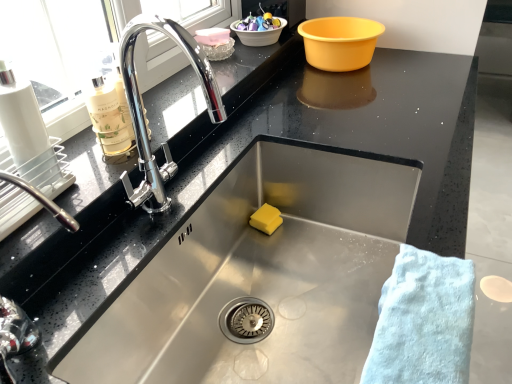
Image resolution: width=512 pixels, height=384 pixels. What do you see at coordinates (42, 201) in the screenshot?
I see `polished chrome tap at left` at bounding box center [42, 201].

Identify the location of yellow plastic basin at upper right, positioned as the 1th basin in right-to-left order. click(339, 42).

Where is `glossy ceramic bowl at upper center, which appears as the 1th food when viewed from the back`? This screenshot has height=384, width=512. glossy ceramic bowl at upper center, which appears as the 1th food when viewed from the back is located at coordinates (259, 23).

Can you confirm if white plastic basin at upper center, which is the 2th basin from left to right, is taller than translucent plastic bowl at upper center, acting as the first basin starting from the left?

Yes.

Is point (253, 44) positioned after point (209, 45)?

Yes, point (253, 44) is farther from viewer.

Is white plastic basin at upper center, positioned as the second basin in right-to-left order, outside of translucent plastic bowl at upper center, which ranks as the 3th basin in right-to-left order?

Absolutely, white plastic basin at upper center, positioned as the second basin in right-to-left order, is external to translucent plastic bowl at upper center, which ranks as the 3th basin in right-to-left order.

Considering the relative positions of white plastic basin at upper center, positioned as the second basin in right-to-left order, and translucent plastic bowl at upper center, which ranks as the 3th basin in right-to-left order, in the image provided, is white plastic basin at upper center, positioned as the second basin in right-to-left order, to the left of translucent plastic bowl at upper center, which ranks as the 3th basin in right-to-left order, from the viewer's perspective?

No, white plastic basin at upper center, positioned as the second basin in right-to-left order, is not to the left of translucent plastic bowl at upper center, which ranks as the 3th basin in right-to-left order.

Is yellow plastic basin at upper right, positioned as the third basin in left-to-right order, bigger than pink plastic container at upper center, placed as the second food when sorted from back to front?

Indeed, yellow plastic basin at upper right, positioned as the third basin in left-to-right order, has a larger size compared to pink plastic container at upper center, placed as the second food when sorted from back to front.

Is yellow plastic basin at upper right, positioned as the 1th basin in right-to-left order, at the left side of pink plastic container at upper center, marked as the second food in a top-to-bottom arrangement?

No, yellow plastic basin at upper right, positioned as the 1th basin in right-to-left order, is not to the left of pink plastic container at upper center, marked as the second food in a top-to-bottom arrangement.

Does point (339, 52) come farther from viewer compared to point (221, 44)?

Yes, point (339, 52) is behind point (221, 44).

Is yellow plastic basin at upper right, positioned as the third basin in left-to-right order, not close to pink plastic container at upper center, placed as the second food when sorted from back to front?

yellow plastic basin at upper right, positioned as the third basin in left-to-right order, is actually quite close to pink plastic container at upper center, placed as the second food when sorted from back to front.

Which of these two, white plastic basin at upper center, positioned as the second basin in right-to-left order, or light blue cotton towel at lower right, stands taller?

Standing taller between the two is white plastic basin at upper center, positioned as the second basin in right-to-left order.

From the image's perspective, relative to light blue cotton towel at lower right, is white plastic basin at upper center, which is the 2th basin from left to right, above or below?

white plastic basin at upper center, which is the 2th basin from left to right, is above light blue cotton towel at lower right.

Does white plastic basin at upper center, which is the 2th basin from left to right, have a smaller size compared to light blue cotton towel at lower right?

Yes.

Find the location of a particular element. Image resolution: width=512 pixels, height=384 pixels. bath towel below the white plastic basin at upper center, positioned as the second basin in right-to-left order (from a real-world perspective) is located at coordinates (423, 321).

From the picture: Which object is further away from the camera taking this photo, pink plastic container at upper center, the second food in the front-to-back sequence, or translucent plastic bowl at upper center, acting as the first basin starting from the left?

translucent plastic bowl at upper center, acting as the first basin starting from the left, is behind.

Who is taller, pink plastic container at upper center, the second food in the front-to-back sequence, or translucent plastic bowl at upper center, acting as the first basin starting from the left?

With more height is translucent plastic bowl at upper center, acting as the first basin starting from the left.

Measure the distance from pink plastic container at upper center, placed as the second food when sorted from back to front, to translucent plastic bowl at upper center, acting as the first basin starting from the left.

A distance of 1.23 inches exists between pink plastic container at upper center, placed as the second food when sorted from back to front, and translucent plastic bowl at upper center, acting as the first basin starting from the left.

Would you consider pink plastic container at upper center, placed as the second food when sorted from back to front, to be distant from translucent plastic bowl at upper center, which ranks as the 3th basin in right-to-left order?

No.

Is point (211, 38) farther from camera compared to point (272, 25)?

No.

Is pink plastic container at upper center, marked as the second food in a top-to-bottom arrangement, to the left of glossy ceramic bowl at upper center, which appears as the 1th food when viewed from the back, from the viewer's perspective?

Indeed, pink plastic container at upper center, marked as the second food in a top-to-bottom arrangement, is positioned on the left side of glossy ceramic bowl at upper center, which appears as the 1th food when viewed from the back.

Can you tell me how much pink plastic container at upper center, placed as the second food when sorted from back to front, and glossy ceramic bowl at upper center, the first food when ordered from top to bottom, differ in facing direction?

The facing directions of pink plastic container at upper center, placed as the second food when sorted from back to front, and glossy ceramic bowl at upper center, the first food when ordered from top to bottom, are 0.0013 degrees apart.

From the picture: Is there a large distance between pink plastic container at upper center, placed as the second food when sorted from back to front, and glossy ceramic bowl at upper center, which appears as the 1th food when viewed from the back?

pink plastic container at upper center, placed as the second food when sorted from back to front, is near glossy ceramic bowl at upper center, which appears as the 1th food when viewed from the back, not far away.

Is there a large distance between yellow sponge at sink bottom, positioned as the first food in front-to-back order, and translucent glass bottle at left?

They are positioned close to each other.

From a real-world perspective, between yellow sponge at sink bottom, positioned as the first food in front-to-back order, and translucent glass bottle at left, who is vertically higher?

In real-world perspective, translucent glass bottle at left is above.

From the image's perspective, is yellow sponge at sink bottom, positioned as the first food in front-to-back order, on translucent glass bottle at left?

Incorrect, from the image's perspective, yellow sponge at sink bottom, positioned as the first food in front-to-back order, is lower than translucent glass bottle at left.

Do you think yellow sponge at sink bottom, positioned as the first food in front-to-back order, is within translucent glass bottle at left, or outside of it?

yellow sponge at sink bottom, positioned as the first food in front-to-back order, is located beyond the bounds of translucent glass bottle at left.

Who is bigger, pink plastic container at upper center, the second food positioned from the bottom, or translucent glass bottle at left?

translucent glass bottle at left is bigger.

From a real-world perspective, is pink plastic container at upper center, the second food positioned from the bottom, above or below translucent glass bottle at left?

pink plastic container at upper center, the second food positioned from the bottom, is below translucent glass bottle at left.

Consider the image. Is pink plastic container at upper center, the second food in the front-to-back sequence, far from translucent glass bottle at left?

No.

Image resolution: width=512 pixels, height=384 pixels. Find the location of `cleaning product above the pink plastic container at upper center, the second food positioned from the bottom (from a real-world perspective)`. cleaning product above the pink plastic container at upper center, the second food positioned from the bottom (from a real-world perspective) is located at coordinates (110, 118).

At what (x,y) coordinates should I click in order to perform the action: click on the 1st basin in front when counting from the white plastic basin at upper center, which is the 2th basin from left to right. Please return your answer as a coordinate pair (x, y). Looking at the image, I should click on (219, 51).

This screenshot has width=512, height=384. There is a yellow plastic basin at upper right, positioned as the 1th basin in right-to-left order. What are the coordinates of `the 1st food above it (from a real-world perspective)` in the screenshot? It's located at (212, 36).

Based on their spatial positions, is light blue cotton towel at lower right or glossy ceramic bowl at upper center, marked as the 3th food in a front-to-back arrangement, closer to white plastic basin at upper center, which is the 2th basin from left to right?

The object closer to white plastic basin at upper center, which is the 2th basin from left to right, is glossy ceramic bowl at upper center, marked as the 3th food in a front-to-back arrangement.

Based on their spatial positions, is light blue cotton towel at lower right or pink plastic container at upper center, placed as the second food when sorted from back to front, closer to translucent plastic bowl at upper center, acting as the first basin starting from the left?

pink plastic container at upper center, placed as the second food when sorted from back to front, lies closer to translucent plastic bowl at upper center, acting as the first basin starting from the left, than the other object.

Based on the photo, which object lies nearer to the anchor point glossy ceramic bowl at upper center, which appears as the 1th food when viewed from the back, translucent plastic bowl at upper center, which ranks as the 3th basin in right-to-left order, or yellow plastic basin at upper right, positioned as the third basin in left-to-right order?

Among the two, translucent plastic bowl at upper center, which ranks as the 3th basin in right-to-left order, is located nearer to glossy ceramic bowl at upper center, which appears as the 1th food when viewed from the back.

Looking at the image, which one is located further to yellow plastic basin at upper right, positioned as the third basin in left-to-right order, white plastic basin at upper center, positioned as the second basin in right-to-left order, or yellow sponge at sink bottom, which is the 1th food from bottom to top?

yellow sponge at sink bottom, which is the 1th food from bottom to top, is positioned further to the anchor yellow plastic basin at upper right, positioned as the third basin in left-to-right order.

When comparing their distances from light blue cotton towel at lower right, does yellow sponge at sink bottom, positioned as the 3th food in top-to-bottom order, or polished chrome tap at left seem further?

yellow sponge at sink bottom, positioned as the 3th food in top-to-bottom order, lies further to light blue cotton towel at lower right than the other object.

Considering their positions, is yellow plastic basin at upper right, positioned as the third basin in left-to-right order, positioned further to translucent glass bottle at left than polished chrome tap at left?

Based on the image, yellow plastic basin at upper right, positioned as the third basin in left-to-right order, appears to be further to translucent glass bottle at left.

Which object lies further to the anchor point yellow sponge at sink bottom, which is the 1th food from bottom to top, yellow plastic basin at upper right, positioned as the 1th basin in right-to-left order, or translucent glass bottle at left?

yellow plastic basin at upper right, positioned as the 1th basin in right-to-left order.

Which object lies further to the anchor point translucent plastic bowl at upper center, which ranks as the 3th basin in right-to-left order, pink plastic container at upper center, placed as the second food when sorted from back to front, or polished chrome tap at left?

Among the two, polished chrome tap at left is located further to translucent plastic bowl at upper center, which ranks as the 3th basin in right-to-left order.

Where is `cleaning product positioned between light blue cotton towel at lower right and white plastic basin at upper center, positioned as the second basin in right-to-left order, from near to far`? Image resolution: width=512 pixels, height=384 pixels. cleaning product positioned between light blue cotton towel at lower right and white plastic basin at upper center, positioned as the second basin in right-to-left order, from near to far is located at coordinates (110, 118).

Where is `cleaning product positioned between polished chrome tap at left and yellow sponge at sink bottom, positioned as the third food in back-to-front order, from near to far`? Image resolution: width=512 pixels, height=384 pixels. cleaning product positioned between polished chrome tap at left and yellow sponge at sink bottom, positioned as the third food in back-to-front order, from near to far is located at coordinates (110, 118).

The height and width of the screenshot is (384, 512). Find the location of `basin located between polished chrome tap at left and translucent plastic bowl at upper center, acting as the first basin starting from the left, in the depth direction`. basin located between polished chrome tap at left and translucent plastic bowl at upper center, acting as the first basin starting from the left, in the depth direction is located at coordinates (339, 42).

Find the location of a particular element. Image resolution: width=512 pixels, height=384 pixels. basin that lies between pink plastic container at upper center, placed as the second food when sorted from back to front, and yellow sponge at sink bottom, positioned as the third food in back-to-front order, from top to bottom is located at coordinates (219, 51).